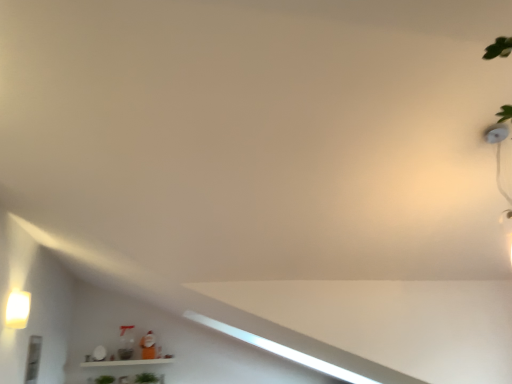
Question: Is green matte plant at lower center, which is the second plant from left to right, in contact with green leafy plant at lower center, the 2th plant from the right?

Choices:
 (A) yes
 (B) no

Answer: (B)

Question: Does green matte plant at lower center, arranged as the first plant when viewed from the right, have a lesser height compared to green leafy plant at lower center, the 2th plant from the right?

Choices:
 (A) yes
 (B) no

Answer: (B)

Question: Is green matte plant at lower center, which is the second plant from left to right, bigger than green leafy plant at lower center, which appears as the 1th plant when viewed from the left?

Choices:
 (A) no
 (B) yes

Answer: (B)

Question: Considering the relative positions of green matte plant at lower center, which is the second plant from left to right, and green leafy plant at lower center, which appears as the 1th plant when viewed from the left, in the image provided, is green matte plant at lower center, which is the second plant from left to right, to the left of green leafy plant at lower center, which appears as the 1th plant when viewed from the left, from the viewer's perspective?

Choices:
 (A) yes
 (B) no

Answer: (B)

Question: Can you confirm if green matte plant at lower center, arranged as the first plant when viewed from the right, is taller than green leafy plant at lower center, the 2th plant from the right?

Choices:
 (A) yes
 (B) no

Answer: (A)

Question: Is green leafy plant at lower center, the 2th plant from the right, spatially inside matte white light fixture at left, or outside of it?

Choices:
 (A) outside
 (B) inside

Answer: (A)

Question: In the image, is green leafy plant at lower center, which appears as the 1th plant when viewed from the left, on the left side or the right side of matte white light fixture at left?

Choices:
 (A) left
 (B) right

Answer: (B)

Question: Is point (112, 380) positioned closer to the camera than point (17, 312)?

Choices:
 (A) farther
 (B) closer

Answer: (A)

Question: Is green leafy plant at lower center, which appears as the 1th plant when viewed from the left, taller or shorter than matte white light fixture at left?

Choices:
 (A) short
 (B) tall

Answer: (A)

Question: Which is correct: green matte plant at lower center, arranged as the first plant when viewed from the right, is inside green leafy plant at lower center, the 2th plant from the right, or outside of it?

Choices:
 (A) outside
 (B) inside

Answer: (A)

Question: Is green matte plant at lower center, which is the second plant from left to right, taller or shorter than green leafy plant at lower center, which appears as the 1th plant when viewed from the left?

Choices:
 (A) tall
 (B) short

Answer: (A)

Question: Is green matte plant at lower center, arranged as the first plant when viewed from the right, to the left or to the right of green leafy plant at lower center, which appears as the 1th plant when viewed from the left, in the image?

Choices:
 (A) right
 (B) left

Answer: (A)

Question: From a real-world perspective, is green matte plant at lower center, which is the second plant from left to right, positioned above or below green leafy plant at lower center, which appears as the 1th plant when viewed from the left?

Choices:
 (A) below
 (B) above

Answer: (B)

Question: From their relative heights in the image, would you say green matte plant at lower center, arranged as the first plant when viewed from the right, is taller or shorter than matte white light fixture at left?

Choices:
 (A) short
 (B) tall

Answer: (A)

Question: From the image's perspective, is green matte plant at lower center, which is the second plant from left to right, positioned above or below matte white light fixture at left?

Choices:
 (A) below
 (B) above

Answer: (A)